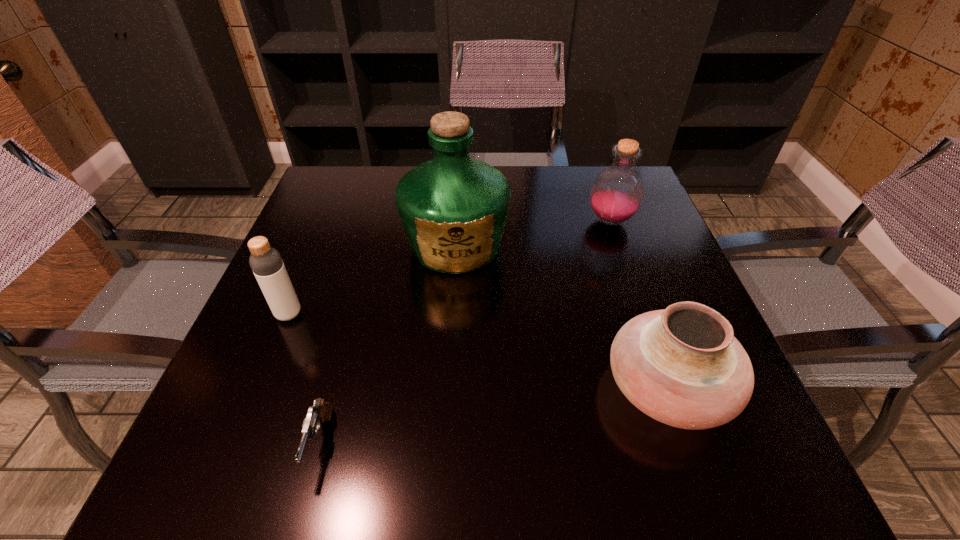
Locate an element on the screen. The image size is (960, 540). free location located 0.270m on the back of the nearer bottle is located at coordinates (325, 225).

Where is `free location located on the left of the pottery`? Image resolution: width=960 pixels, height=540 pixels. free location located on the left of the pottery is located at coordinates (507, 387).

Identify the location of liquor that is at the far edge. Image resolution: width=960 pixels, height=540 pixels. (453, 208).

The height and width of the screenshot is (540, 960). What are the coordinates of `bottle that is at the far edge` in the screenshot? It's located at (617, 192).

Locate an element on the screen. pottery located at the near edge is located at coordinates (682, 366).

Where is `pistol that is positioned at the near edge`? pistol that is positioned at the near edge is located at coordinates (321, 411).

Locate an element on the screen. object at the left edge is located at coordinates (266, 262).

What are the coordinates of `bottle located at the right edge` in the screenshot? It's located at (617, 192).

Identify the location of pottery that is positioned at the right edge. This screenshot has height=540, width=960. [x=682, y=366].

Where is `object located at the far right corner`? The image size is (960, 540). object located at the far right corner is located at coordinates (617, 192).